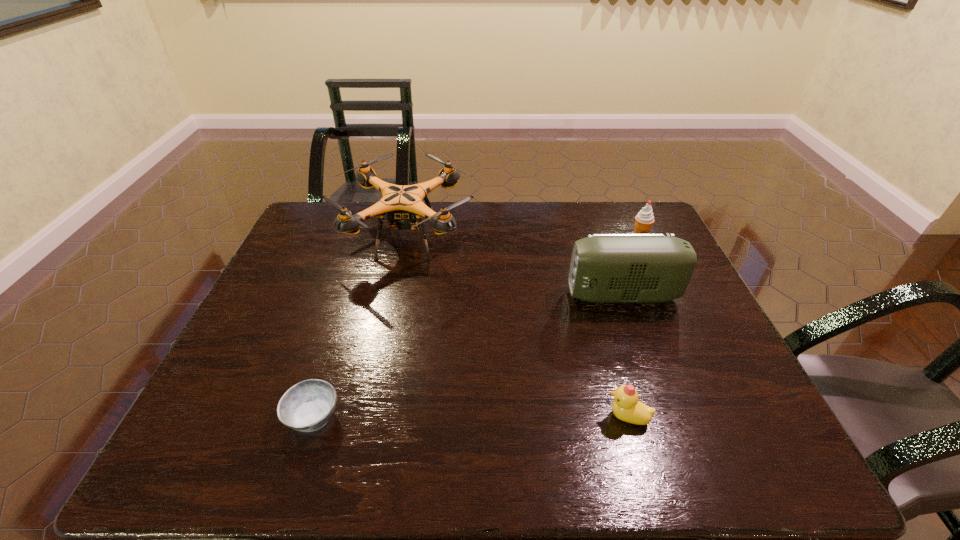
Find the location of `vacant space that's between the drone and the third tallest object`. vacant space that's between the drone and the third tallest object is located at coordinates (523, 238).

I want to click on vacant space in between the third tallest object and the shortest object, so click(476, 327).

Locate an element on the screen. Image resolution: width=960 pixels, height=540 pixels. unoccupied area between the third shortest object and the fourth tallest object is located at coordinates (634, 327).

This screenshot has height=540, width=960. I want to click on free space between the radio_receiver and the ashtray, so click(468, 355).

Image resolution: width=960 pixels, height=540 pixels. Identify the location of empty space between the duckling and the radio_receiver. (625, 356).

I want to click on empty space that is in between the drone and the icecream, so click(523, 238).

At what (x,y) coordinates should I click in order to perform the action: click on free space between the duckling and the drone. Please return your answer as a coordinate pair (x, y). Image resolution: width=960 pixels, height=540 pixels. Looking at the image, I should click on (517, 327).

Locate which object is the second closest to the shortest object. Please provide its 2D coordinates. Your answer should be formatted as a tuple, i.e. [(x, y)], where the tuple contains the x and y coordinates of a point satisfying the conditions above.

[(626, 407)]

Find the location of a particular element. The image size is (960, 540). object that ranks as the fourth closest to the shortest object is located at coordinates (643, 221).

Image resolution: width=960 pixels, height=540 pixels. Find the location of `free space that satisfies the following two spatial constraints: 1. on the front side of the icecream; 2. on the front-facing side of the duckling`. free space that satisfies the following two spatial constraints: 1. on the front side of the icecream; 2. on the front-facing side of the duckling is located at coordinates (723, 417).